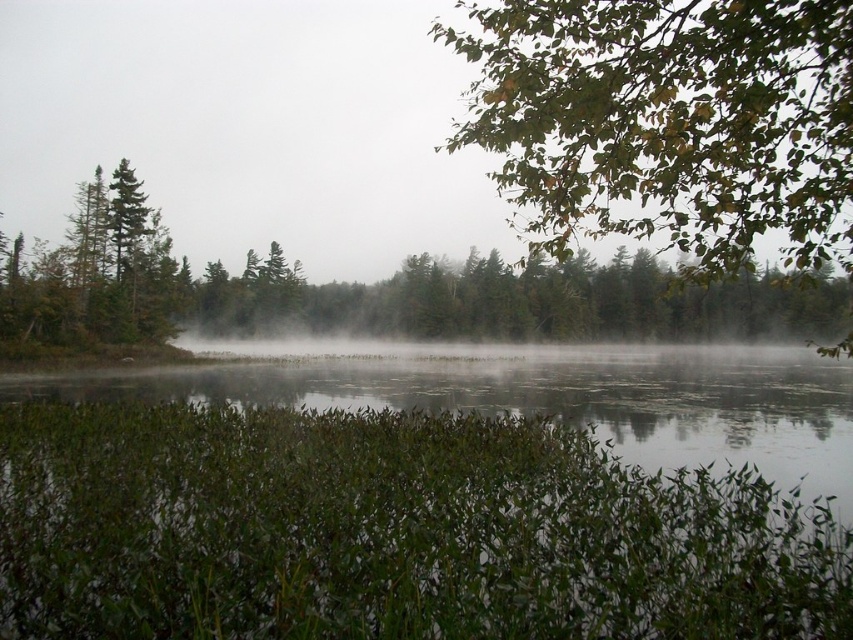
You are an artist trying to paint the landscape. You have to decide which object to paint first based on their positions. Which one is taller between the green leafy branch at upper right and the green matte tree at upper center?

The green leafy branch at upper right is much taller than the green matte tree at upper center, so you should paint the green leafy branch at upper right first to ensure proper layering.